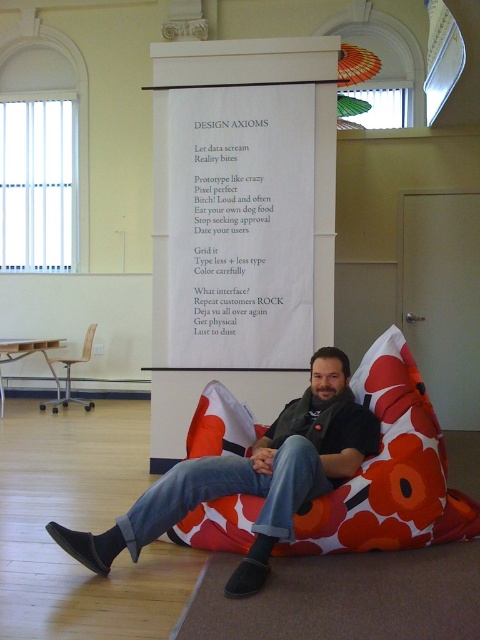
Consider the image. Does floral fabric bean bag at center have a larger size compared to wooden chair at left?

Correct, floral fabric bean bag at center is larger in size than wooden chair at left.

Which is below, floral fabric bean bag at center or wooden chair at left?

floral fabric bean bag at center is lower down.

Is point (237, 506) behind point (57, 404)?

That is False.

At what (x,y) coordinates should I click in order to perform the action: click on floral fabric bean bag at center. Please return your answer as a coordinate pair (x, y). This screenshot has width=480, height=640. Looking at the image, I should click on (391, 470).

Does denim jeans at center appear under wooden chair at left?

Yes.

Find the location of a particular element. The height and width of the screenshot is (640, 480). denim jeans at center is located at coordinates (252, 477).

Can you confirm if floral fabric bean bag at center is shorter than denim jeans at center?

No.

From the picture: Can you confirm if floral fabric bean bag at center is thinner than denim jeans at center?

In fact, floral fabric bean bag at center might be wider than denim jeans at center.

Find the location of a particular element. This screenshot has width=480, height=640. floral fabric bean bag at center is located at coordinates (391, 470).